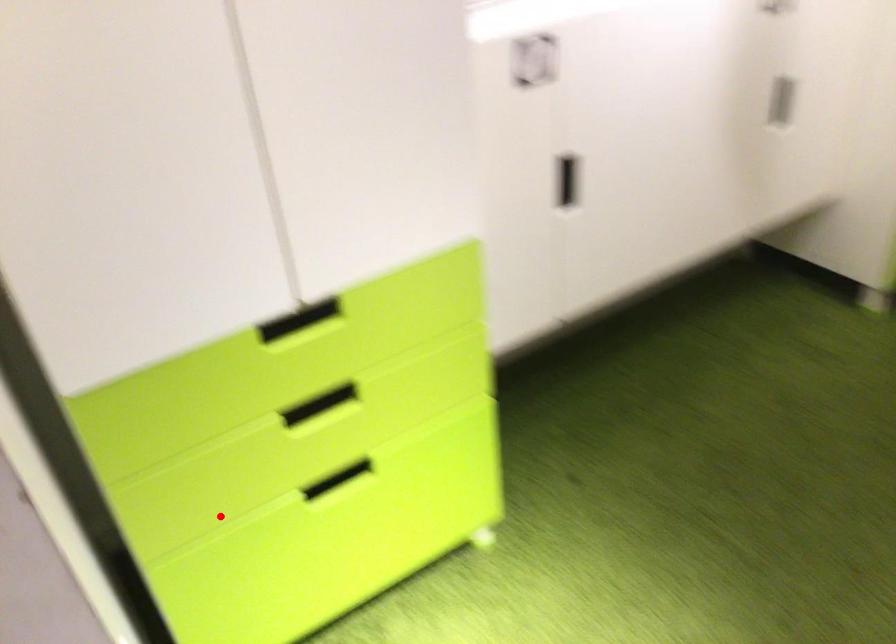
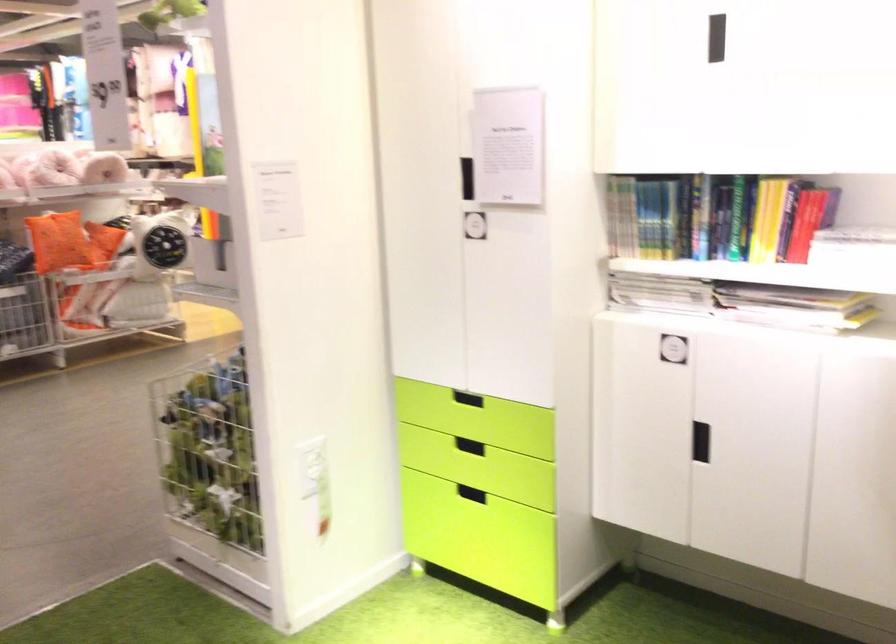
In the second image, find the point that corresponds to the highlighted location in the first image.

(471, 494)